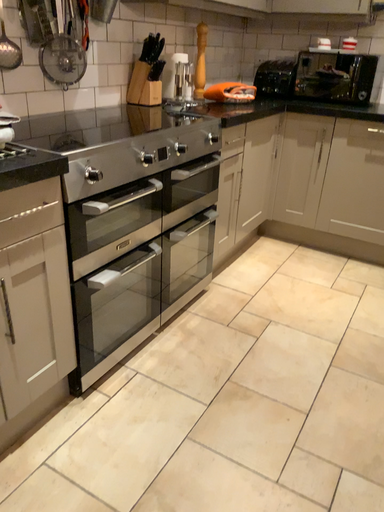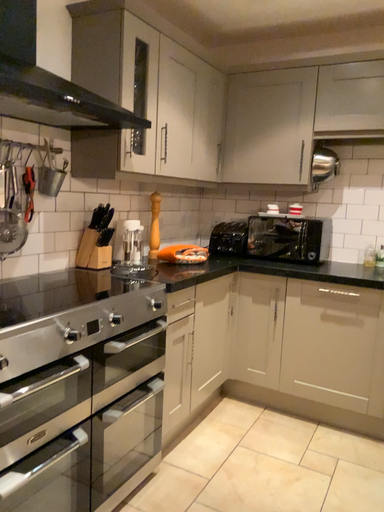
Question: Which way did the camera rotate in the video?

Choices:
 (A) rotated upward
 (B) rotated downward

Answer: (A)